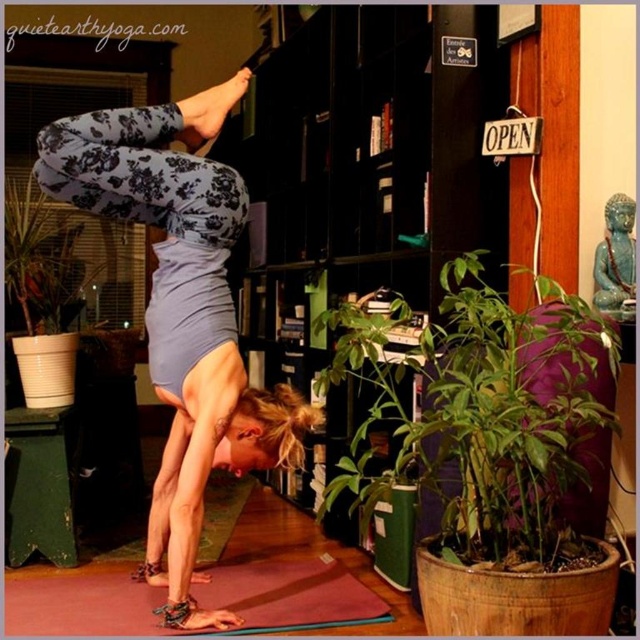
Question: Is rubber yoga mat at lower center positioned at the back of green leafy plant at lower left?

Choices:
 (A) yes
 (B) no

Answer: (B)

Question: Which point is closer to the camera?

Choices:
 (A) green leafy plant at lower left
 (B) black wood bookshelf at center
 (C) green leafy plant at lower right
 (D) floral leggings at center

Answer: (C)

Question: Which object is closer to the camera taking this photo?

Choices:
 (A) rubber yoga mat at lower center
 (B) green leafy plant at lower right
 (C) black wood bookshelf at center
 (D) floral leggings at center

Answer: (B)

Question: Which point is closer to the camera taking this photo?

Choices:
 (A) (156, 589)
 (B) (486, 486)

Answer: (B)

Question: Is floral leggings at center bigger than rubber yoga mat at lower center?

Choices:
 (A) yes
 (B) no

Answer: (A)

Question: Can you confirm if rubber yoga mat at lower center is positioned above green leafy plant at lower left?

Choices:
 (A) no
 (B) yes

Answer: (A)